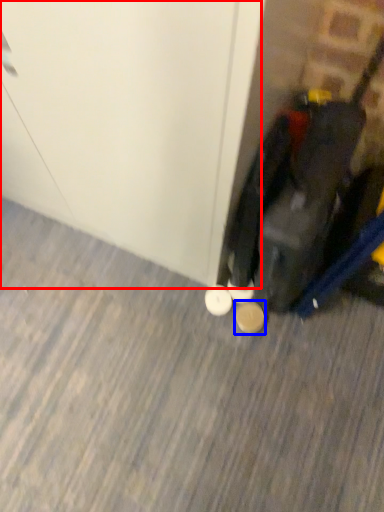
Question: Which point is further to the camera, door (highlighted by a red box) or footwear (highlighted by a blue box)?

Choices:
 (A) door
 (B) footwear

Answer: (B)